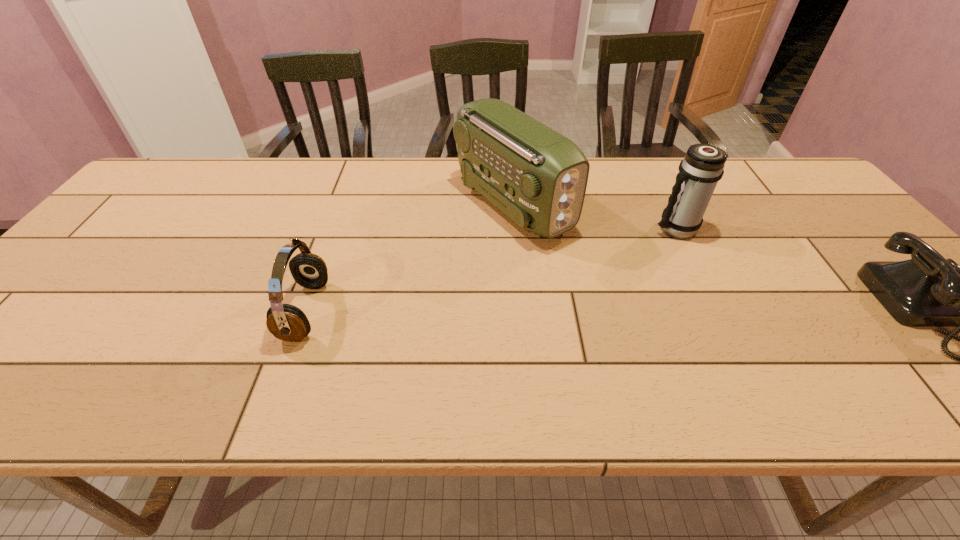
Where is `free space on the desktop that is between the third tallest object and the telephone and is positioned on the front-facing side of the radio_receiver`? The image size is (960, 540). free space on the desktop that is between the third tallest object and the telephone and is positioned on the front-facing side of the radio_receiver is located at coordinates (646, 311).

Image resolution: width=960 pixels, height=540 pixels. What are the coordinates of `vacant space on the desktop that is between the leftmost object and the telephone and is positioned on the side with the handle of the thermos bottle` in the screenshot? It's located at (547, 311).